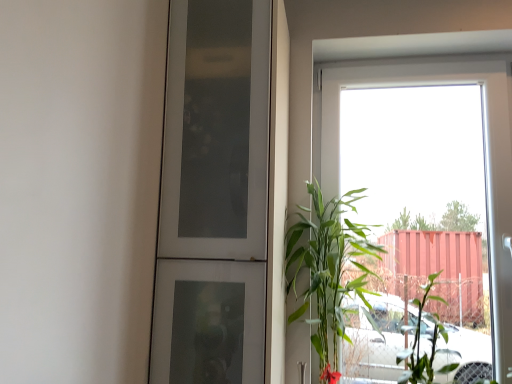
Question: From a real-world perspective, is green leafy plant at right below transparent glass window at upper right?

Choices:
 (A) yes
 (B) no

Answer: (A)

Question: Does green leafy plant at right have a greater height compared to transparent glass window at upper right?

Choices:
 (A) no
 (B) yes

Answer: (A)

Question: Considering the relative positions of green leafy plant at right and transparent glass window at upper right in the image provided, is green leafy plant at right behind transparent glass window at upper right?

Choices:
 (A) yes
 (B) no

Answer: (B)

Question: Is green leafy plant at right at the left side of transparent glass window at upper right?

Choices:
 (A) no
 (B) yes

Answer: (B)

Question: Considering the relative sizes of green leafy plant at right and transparent glass window at upper right in the image provided, is green leafy plant at right bigger than transparent glass window at upper right?

Choices:
 (A) no
 (B) yes

Answer: (A)

Question: Considering the positions of transparent glass window at upper right and white frosted glass door at center in the image, is transparent glass window at upper right taller or shorter than white frosted glass door at center?

Choices:
 (A) short
 (B) tall

Answer: (B)

Question: Looking at the image, does transparent glass window at upper right seem bigger or smaller compared to white frosted glass door at center?

Choices:
 (A) big
 (B) small

Answer: (B)

Question: Relative to white frosted glass door at center, is transparent glass window at upper right in front or behind?

Choices:
 (A) front
 (B) behind

Answer: (B)

Question: Do you think transparent glass window at upper right is within white frosted glass door at center, or outside of it?

Choices:
 (A) inside
 (B) outside

Answer: (B)

Question: Based on their sizes in the image, would you say green leafy plant at right is bigger or smaller than white frosted glass door at center?

Choices:
 (A) small
 (B) big

Answer: (A)

Question: Is green leafy plant at right situated inside white frosted glass door at center or outside?

Choices:
 (A) inside
 (B) outside

Answer: (B)

Question: Does point (324, 312) appear closer or farther from the camera than point (163, 221)?

Choices:
 (A) closer
 (B) farther

Answer: (B)

Question: Considering the positions of green leafy plant at right and white frosted glass door at center in the image, is green leafy plant at right wider or thinner than white frosted glass door at center?

Choices:
 (A) wide
 (B) thin

Answer: (B)

Question: Is green leafy plant at right wider or thinner than green leafy plant at right?

Choices:
 (A) thin
 (B) wide

Answer: (A)

Question: In the image, is green leafy plant at right on the left side or the right side of green leafy plant at right?

Choices:
 (A) right
 (B) left

Answer: (A)